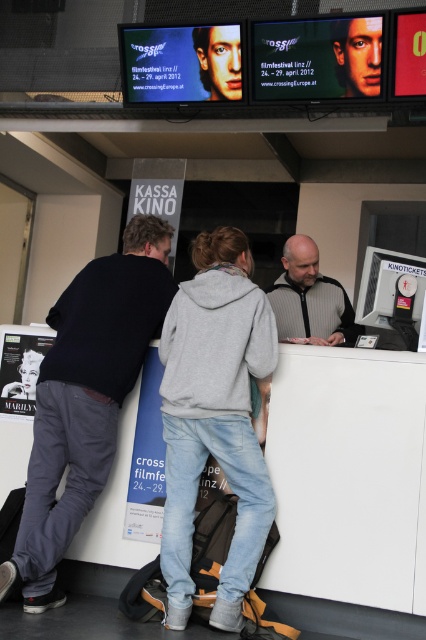
Question: Is gray hoodie at center to the left of dark gray sweater at left from the viewer's perspective?

Choices:
 (A) no
 (B) yes

Answer: (A)

Question: Is gray hoodie at center smaller than dark gray sweater at left?

Choices:
 (A) no
 (B) yes

Answer: (B)

Question: Is dark gray sweater at left smaller than gray striped jacket at center?

Choices:
 (A) yes
 (B) no

Answer: (B)

Question: Among these points, which one is nearest to the camera?

Choices:
 (A) (161, 301)
 (B) (259, 490)
 (C) (299, 291)

Answer: (B)

Question: Which of these objects is positioned closest to the gray striped jacket at center?

Choices:
 (A) dark gray sweater at left
 (B) gray hoodie at center

Answer: (B)

Question: Which object is positioned farthest from the gray hoodie at center?

Choices:
 (A) dark gray sweater at left
 (B) gray striped jacket at center

Answer: (B)